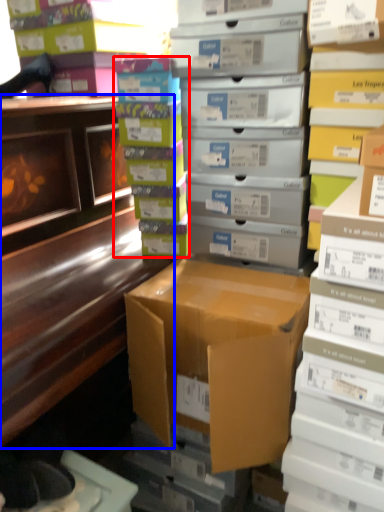
Question: Which of the following is the closest to the observer, book (highlighted by a red box) or desk (highlighted by a blue box)?

Choices:
 (A) book
 (B) desk

Answer: (B)